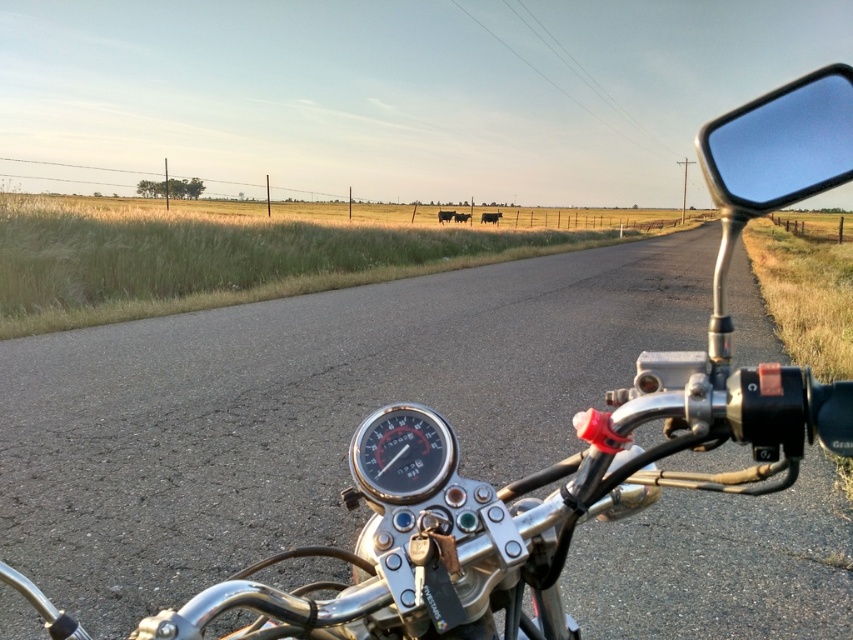
You are riding a motorcycle and looking at the handlebars. You notice the green grass at left and the clear glass mirror at right. Which object is wider from your perspective?

The green grass at left is wider than the clear glass mirror at right.

You are riding a motorcycle and looking at the dashboard. You notice the green grass at left and the clear glass mirror at right. Which one takes up more space in your view?

The green grass at left takes up more space in your view because it is bigger than the clear glass mirror at right.

You are riding a motorcycle and looking at the dashboard. You notice the green grass at left and the black plastic speedometer at center. Which object is taller?

The green grass at left is taller than the black plastic speedometer at center.